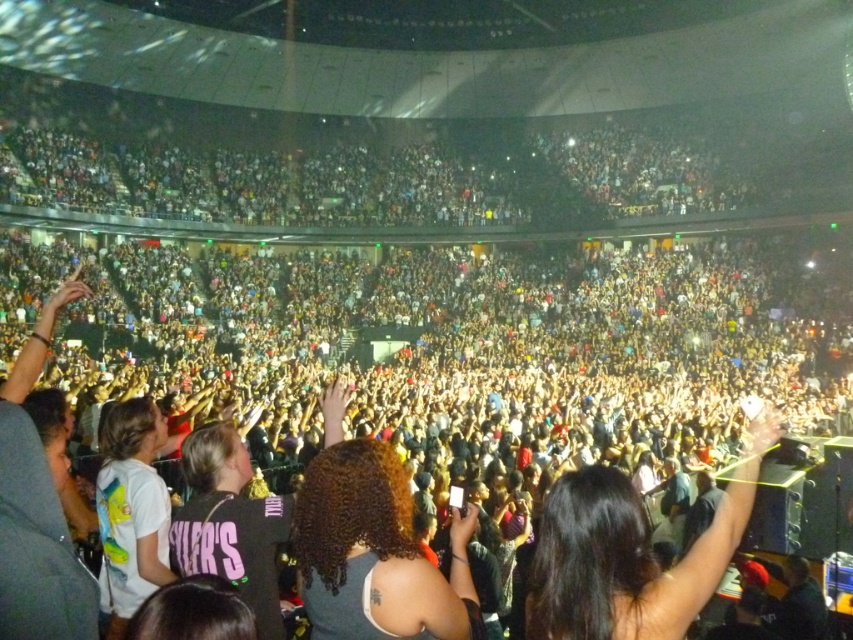
You are at the concert and want to find someone with curly hair at center. Can you see the point marked at coordinate (374, 552)? Where is it located?

The point marked at coordinate (374, 552) is located on curly hair at center.